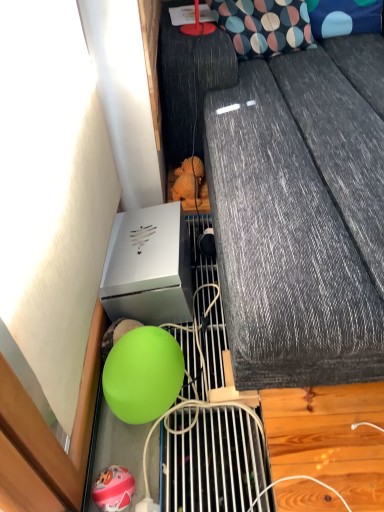
Question: Considering the relative sizes of matte green balloon at lower left and green matte ball at lower center in the image provided, is matte green balloon at lower left thinner than green matte ball at lower center?

Choices:
 (A) yes
 (B) no

Answer: (A)

Question: Is matte green balloon at lower left further to camera compared to green matte ball at lower center?

Choices:
 (A) yes
 (B) no

Answer: (B)

Question: From a real-world perspective, is matte green balloon at lower left physically above green matte ball at lower center?

Choices:
 (A) yes
 (B) no

Answer: (B)

Question: Does matte green balloon at lower left appear on the right side of green matte ball at lower center?

Choices:
 (A) yes
 (B) no

Answer: (B)

Question: Is matte green balloon at lower left wider than green matte ball at lower center?

Choices:
 (A) no
 (B) yes

Answer: (A)

Question: Is matte green balloon at lower left closer to camera compared to green matte ball at lower center?

Choices:
 (A) yes
 (B) no

Answer: (A)

Question: Considering the relative sizes of matte green balloon at lower left and green rubber ball at lower left in the image provided, is matte green balloon at lower left taller than green rubber ball at lower left?

Choices:
 (A) yes
 (B) no

Answer: (B)

Question: Is matte green balloon at lower left surrounding green rubber ball at lower left?

Choices:
 (A) yes
 (B) no

Answer: (B)

Question: Considering the relative sizes of matte green balloon at lower left and green rubber ball at lower left in the image provided, is matte green balloon at lower left smaller than green rubber ball at lower left?

Choices:
 (A) yes
 (B) no

Answer: (A)

Question: Are matte green balloon at lower left and green rubber ball at lower left making contact?

Choices:
 (A) yes
 (B) no

Answer: (B)

Question: From the image's perspective, is matte green balloon at lower left located beneath green rubber ball at lower left?

Choices:
 (A) yes
 (B) no

Answer: (A)

Question: From a real-world perspective, is matte green balloon at lower left below green rubber ball at lower left?

Choices:
 (A) yes
 (B) no

Answer: (A)

Question: From a real-world perspective, is blue dotted fabric pillow at upper right, the 2th pillow when ordered from left to right, under matte green balloon at lower left?

Choices:
 (A) yes
 (B) no

Answer: (B)